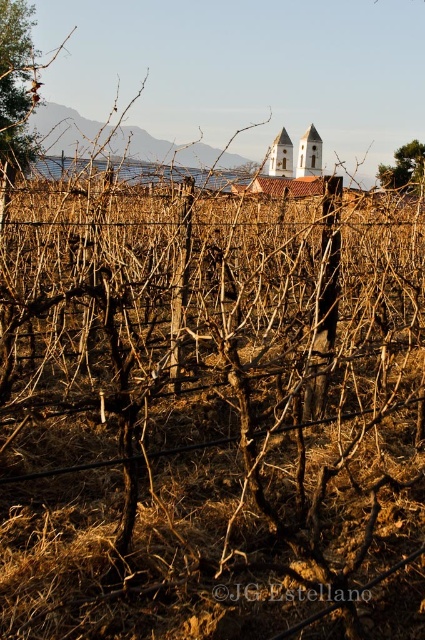
Question: Which point appears farthest from the camera in this image?

Choices:
 (A) (87, 477)
 (B) (33, 67)
 (C) (280, 136)

Answer: (C)

Question: Considering the real-world distances, which object is closest to the white stucco church at center?

Choices:
 (A) brown wood tree at upper left
 (B) wire mesh at center
 (C) green leafy tree at upper right

Answer: (B)

Question: Is wire mesh at center below white stucco chapel at center?

Choices:
 (A) yes
 (B) no

Answer: (A)

Question: Is wire mesh at center in front of white stucco chapel at center?

Choices:
 (A) no
 (B) yes

Answer: (B)

Question: In this image, where is wire mesh at center located relative to brown wood tree at upper left?

Choices:
 (A) below
 (B) above

Answer: (A)

Question: Which object is the farthest from the white stucco chapel at center?

Choices:
 (A) white stucco church at center
 (B) brown wood tree at upper left

Answer: (B)